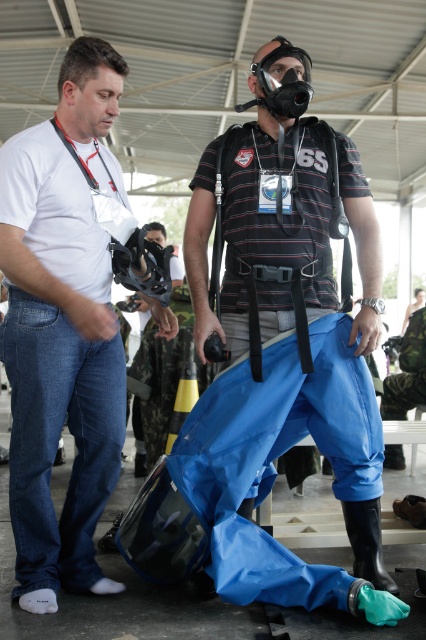
Does blue rubber pants at center appear on the left side of white matte shirt at left?

Incorrect, blue rubber pants at center is not on the left side of white matte shirt at left.

Which is in front, point (287, 173) or point (103, 246)?

Positioned in front is point (287, 173).

Who is more distant from viewer, (325, 285) or (8, 346)?

The point (325, 285) is more distant.

Find the location of a particular element. This screenshot has height=640, width=426. blue rubber pants at center is located at coordinates (296, 285).